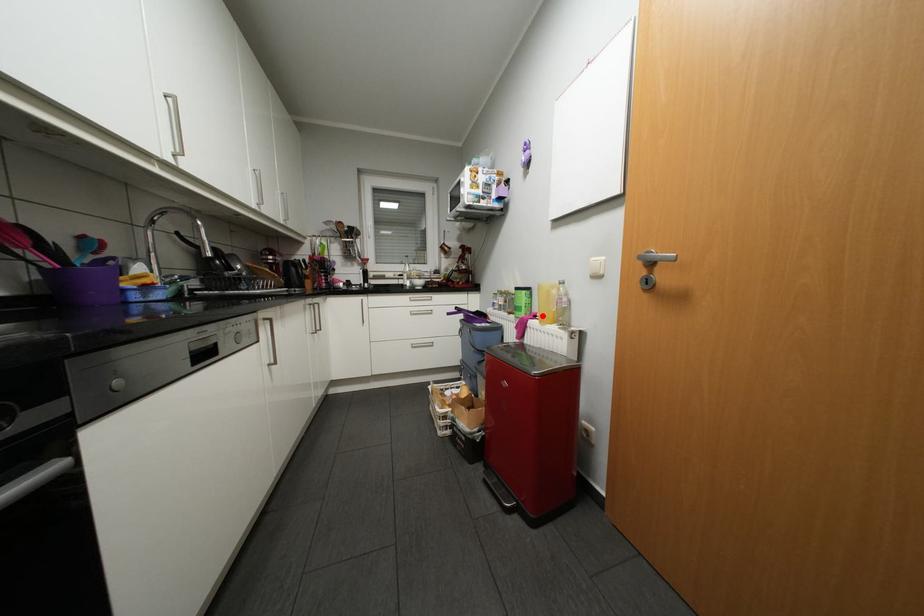
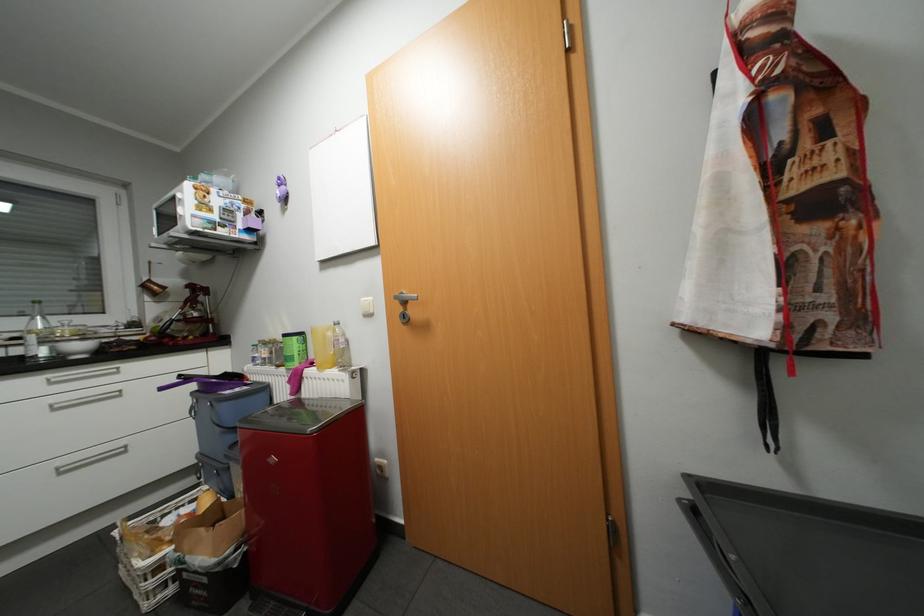
Where in the second image is the point corresponding to the highlighted location from the first image?

(320, 363)